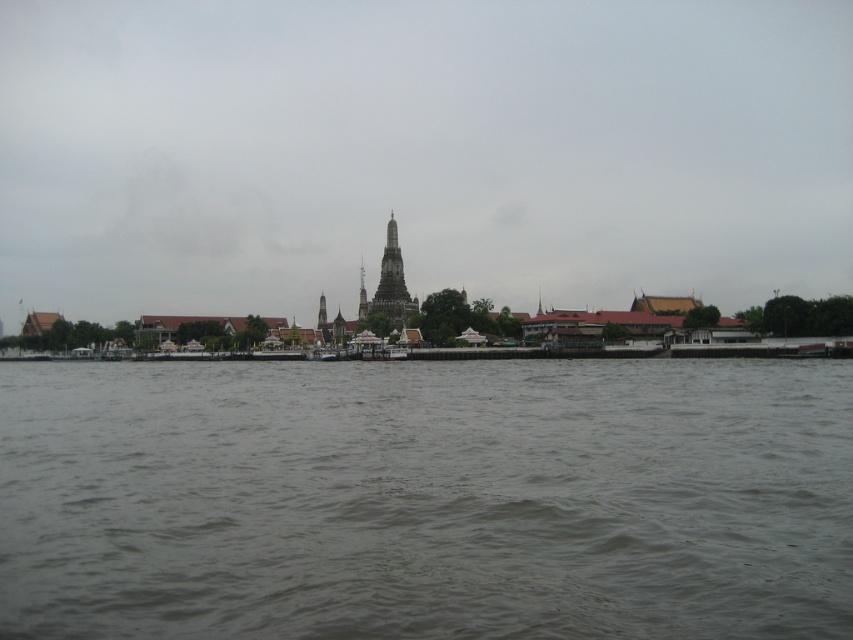
Question: Among these points, which one is farthest from the camera?

Choices:
 (A) (363, 272)
 (B) (86, 140)
 (C) (360, 269)
 (D) (422, 592)

Answer: (A)

Question: Estimate the real-world distances between objects in this image. Which object is closer to the dark gray stone temple at center?

Choices:
 (A) smooth gray spire at center
 (B) brown murky water at center
 (C) transparent sky at center

Answer: (A)

Question: Where is dark gray stone temple at center located in relation to smooth gray spire at center in the image?

Choices:
 (A) right
 (B) left

Answer: (A)

Question: Which of the following is the farthest from the observer?

Choices:
 (A) (363, 317)
 (B) (399, 316)

Answer: (A)

Question: Is transparent sky at center positioned before brown murky water at center?

Choices:
 (A) no
 (B) yes

Answer: (A)

Question: Does brown murky water at center have a greater width compared to smooth gray spire at center?

Choices:
 (A) no
 (B) yes

Answer: (B)